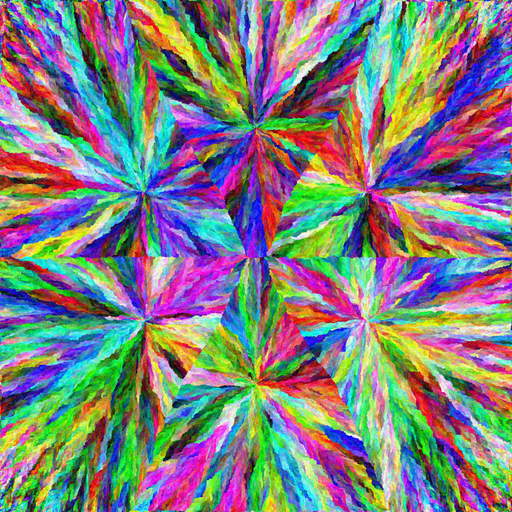
This screenshot has height=512, width=512. In order to click on blue paint in this screenshot , I will do `click(285, 487)`, `click(180, 401)`, `click(267, 271)`, `click(354, 243)`, `click(102, 241)`.